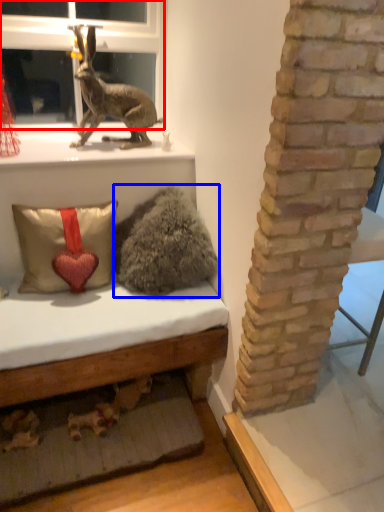
Question: Which point is closer to the camera, bay window (highlighted by a red box) or animal (highlighted by a blue box)?

Choices:
 (A) bay window
 (B) animal

Answer: (B)